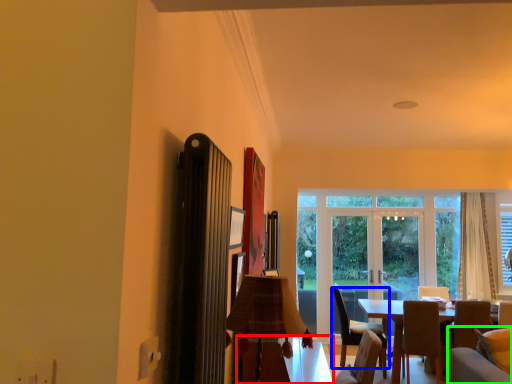
Question: Estimate the real-world distances between objects in this image. Which object is closer to table (highlighted by a red box), chair (highlighted by a blue box) or couch (highlighted by a green box)?

Choices:
 (A) chair
 (B) couch

Answer: (B)